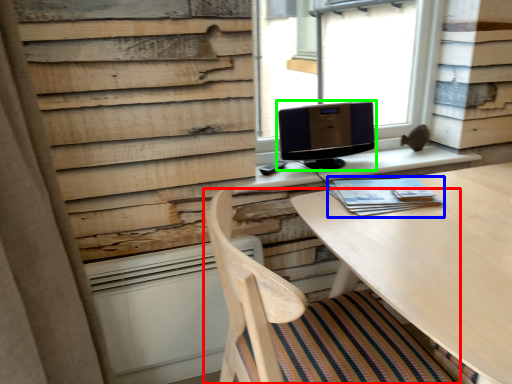
Question: Which is nearer to the chair (highlighted by a red box)? book (highlighted by a blue box) or computer monitor (highlighted by a green box).

Choices:
 (A) book
 (B) computer monitor

Answer: (A)